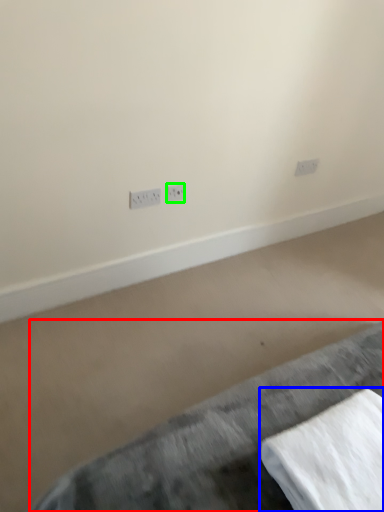
Question: Which object is positioned closest to furniture (highlighted by a red box)? Select from linen (highlighted by a blue box) and power plugs and sockets (highlighted by a green box).

Choices:
 (A) linen
 (B) power plugs and sockets

Answer: (A)